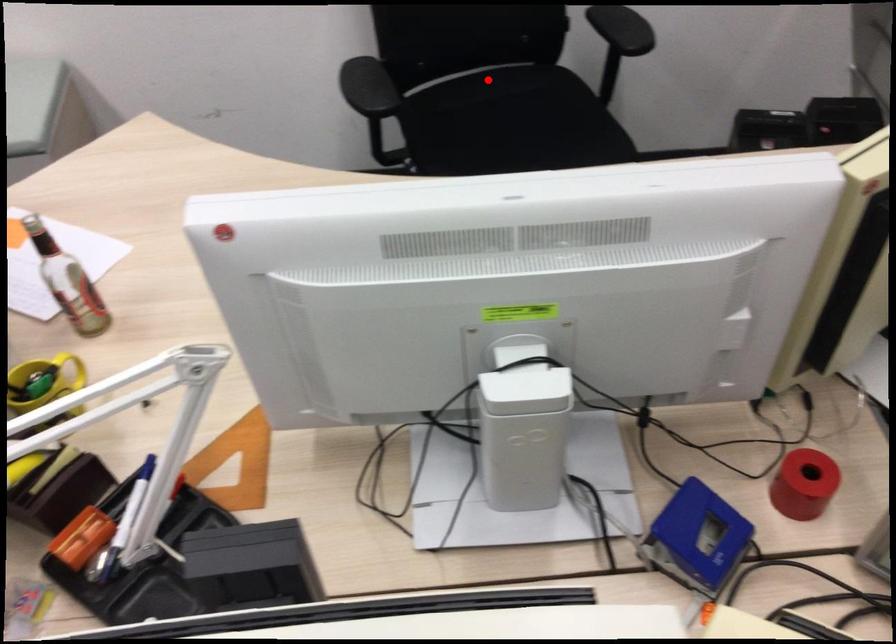
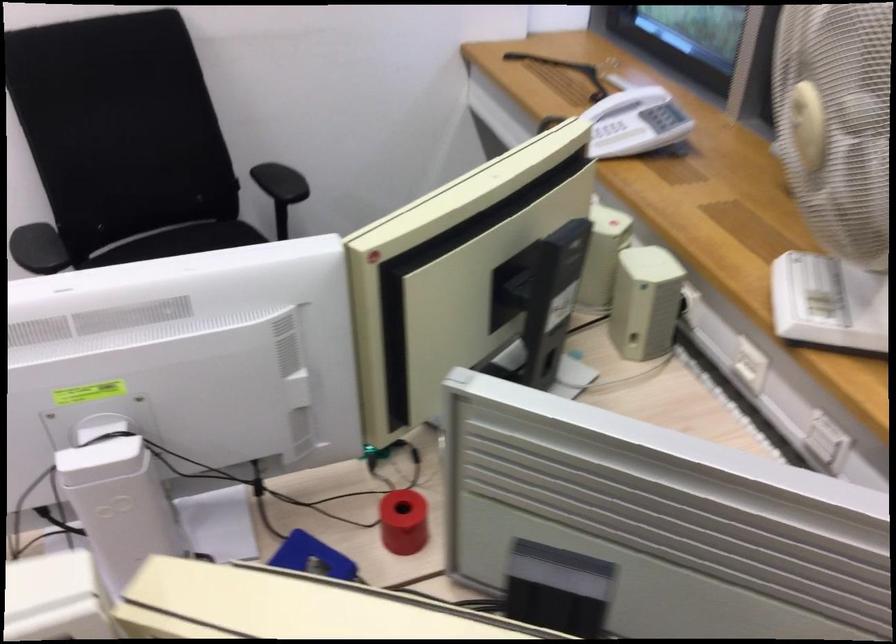
Question: A red point is marked in image1. In image2, is the corresponding 3D point closer to the camera or farther? Reply with the corresponding letter.

Choices:
 (A) The corresponding 3D point is closer.
 (B) The corresponding 3D point is farther.

Answer: (B)